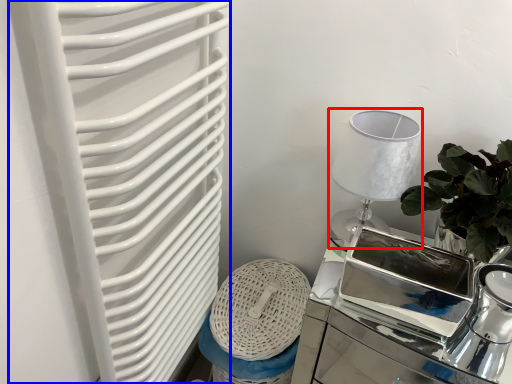
Question: Among these objects, which one is farthest to the camera, table lamp (highlighted by a red box) or radiator (highlighted by a blue box)?

Choices:
 (A) table lamp
 (B) radiator

Answer: (A)